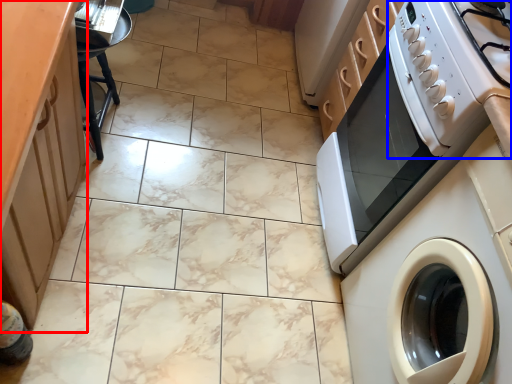
Question: Which point is closer to the camera, cabinetry (highlighted by a red box) or gas stove (highlighted by a blue box)?

Choices:
 (A) cabinetry
 (B) gas stove

Answer: (A)